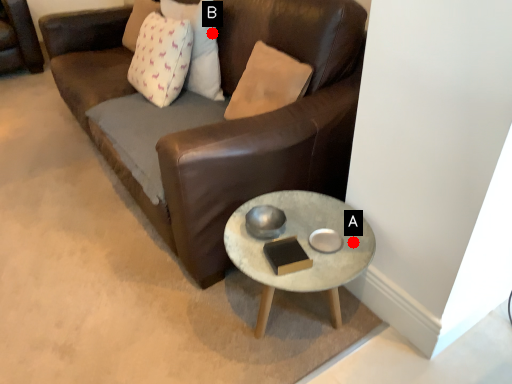
Question: Two points are circled on the image, labeled by A and B beside each circle. Among these points, which one is farthest from the camera?

Choices:
 (A) A is further
 (B) B is further

Answer: (B)